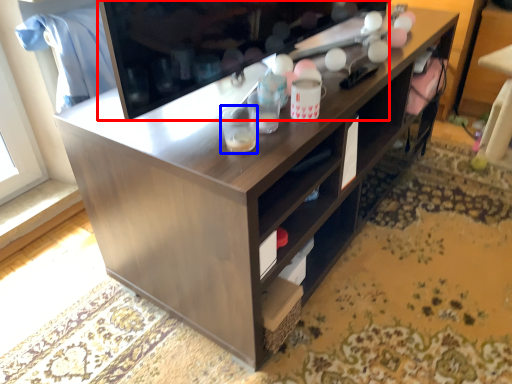
Question: Which of the following is the closest to the observer, television (highlighted by a red box) or beverage (highlighted by a blue box)?

Choices:
 (A) television
 (B) beverage

Answer: (A)